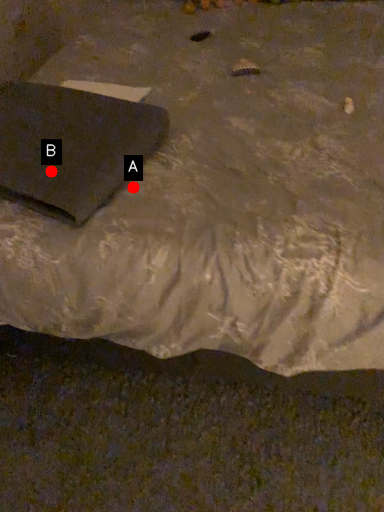
Question: Two points are circled on the image, labeled by A and B beside each circle. Which point is closer to the camera taking this photo?

Choices:
 (A) A is closer
 (B) B is closer

Answer: (B)